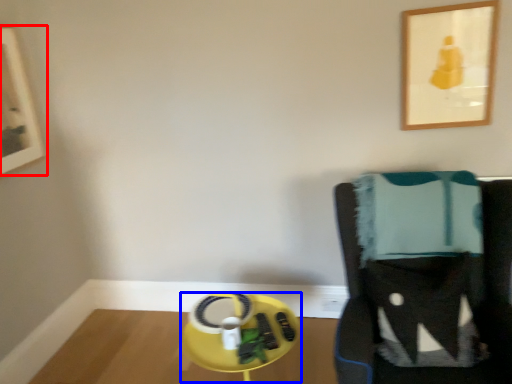
Question: Which of the following is the closest to the observer, picture frame (highlighted by a red box) or round table (highlighted by a blue box)?

Choices:
 (A) picture frame
 (B) round table

Answer: (B)